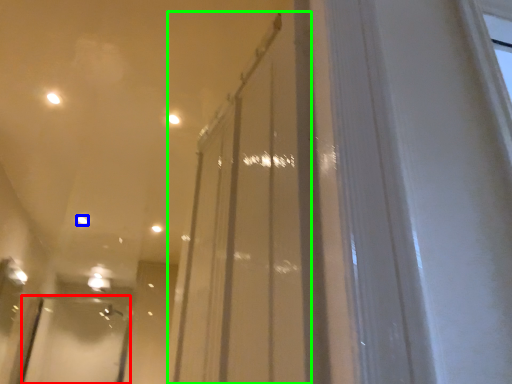
Question: Based on their relative distances, which object is farther from screen door (highlighted by a red box)? Choose from light (highlighted by a blue box) and glass door (highlighted by a green box).

Choices:
 (A) light
 (B) glass door

Answer: (B)